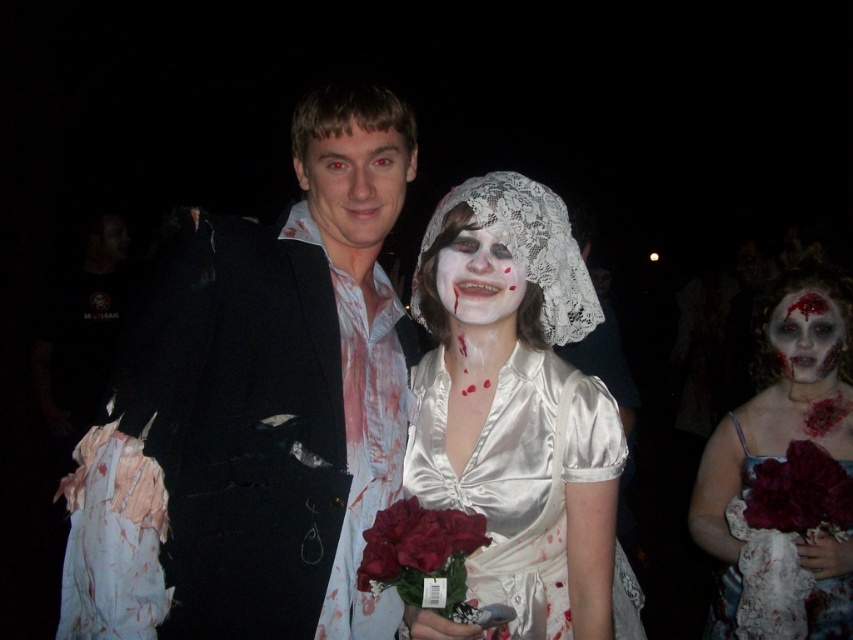
Question: Can you confirm if white lace veil at upper center is positioned above white matte lace veil at center?

Choices:
 (A) yes
 (B) no

Answer: (B)

Question: Does white lace veil at upper center appear under white matte lace veil at center?

Choices:
 (A) yes
 (B) no

Answer: (A)

Question: Is satin dress at center positioned at the back of white matte lace veil at center?

Choices:
 (A) no
 (B) yes

Answer: (A)

Question: Which object is farther from the camera taking this photo?

Choices:
 (A) white matte lace veil at center
 (B) smooth skin face at center

Answer: (A)

Question: Which point appears farthest from the camera in this image?

Choices:
 (A) (402, 531)
 (B) (822, 296)
 (C) (380, 232)

Answer: (B)

Question: Which object is positioned farthest from the smooth skin face at center?

Choices:
 (A) deep red silk rose at lower right
 (B) white matte lace veil at center
 (C) white lace veil at upper center

Answer: (C)